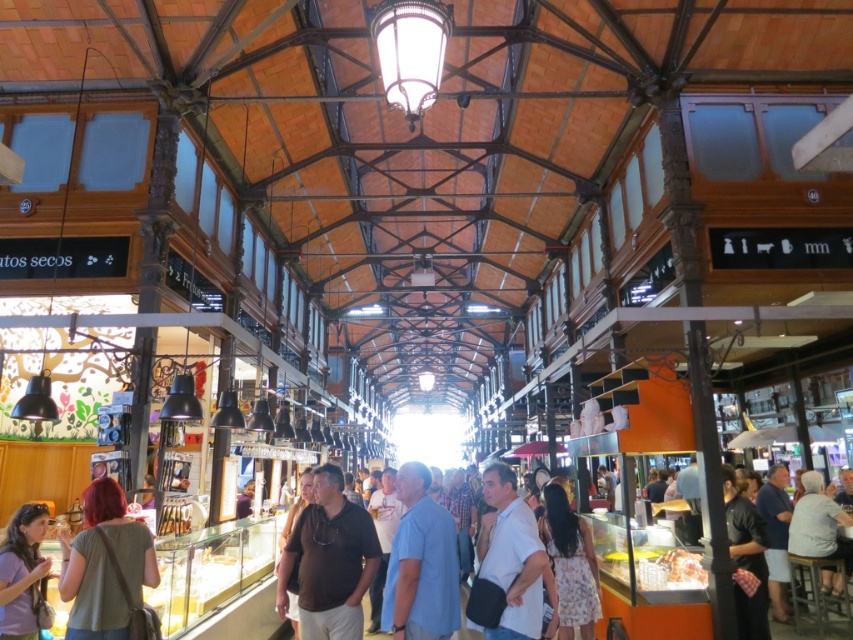
Looking at this image, you are a customer in the market and want to buy a shirt. You see both the blue cotton shirt at center and the white cotton shirt at center. Which shirt is taller?

The blue cotton shirt at center is much taller than the white cotton shirt at center.

In the scene shown: You are a customer in the market and need to decide which shirt to try on first. The brown matte shirt at center and the white cotton shirt at center are both in your size. However, you notice that the changing room is narrow. Considering their widths, which shirt would you choose to try on first to ensure it fits through the changing room door?

The white cotton shirt at center is narrower than the brown matte shirt at center, so you should try on the white cotton shirt at center first to ensure it fits through the narrow changing room door.